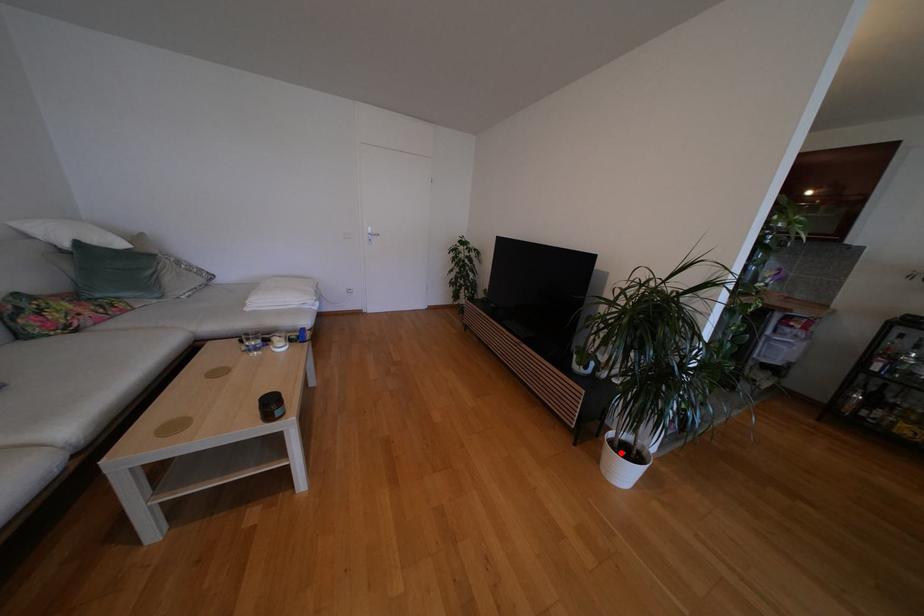
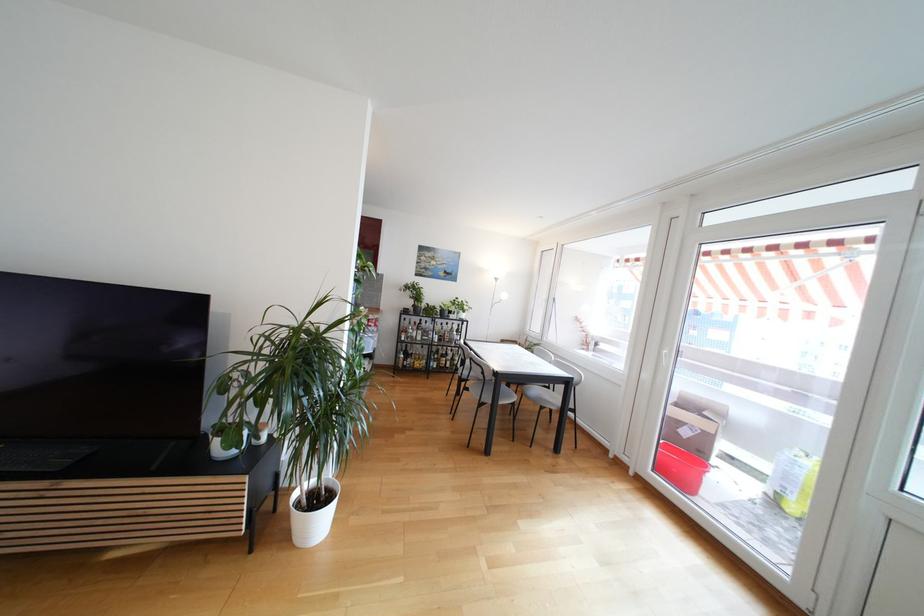
Question: A red point is marked in image1. In image2, is the corresponding 3D point closer to the camera or farther? Reply with the corresponding letter.

Choices:
 (A) The corresponding 3D point is closer.
 (B) The corresponding 3D point is farther.

Answer: (B)